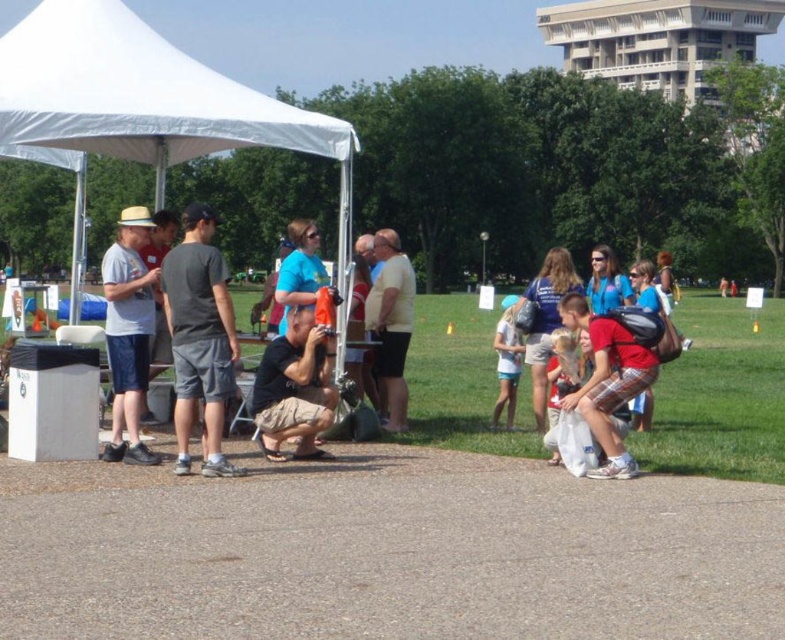
Question: Does white cotton shirt at left appear on the right side of light blue denim shorts at center?

Choices:
 (A) no
 (B) yes

Answer: (A)

Question: Among these objects, which one is nearest to the camera?

Choices:
 (A) white cotton shirt at left
 (B) blue t-shirt at center
 (C) red plaid shorts at lower right

Answer: (C)

Question: Is white fabric tent at upper left positioned behind light blue denim shorts at center?

Choices:
 (A) yes
 (B) no

Answer: (B)

Question: Is black cotton t-shirt at center behind red plaid shorts at lower right?

Choices:
 (A) no
 (B) yes

Answer: (B)

Question: Among these objects, which one is nearest to the camera?

Choices:
 (A) black cotton t-shirt at center
 (B) dark gray cotton t-shirt at center
 (C) white cotton shirt at left
 (D) light yellow t-shirt at center

Answer: (B)

Question: Which of the following is the closest to the observer?

Choices:
 (A) light yellow t-shirt at center
 (B) blue t-shirt at center

Answer: (B)